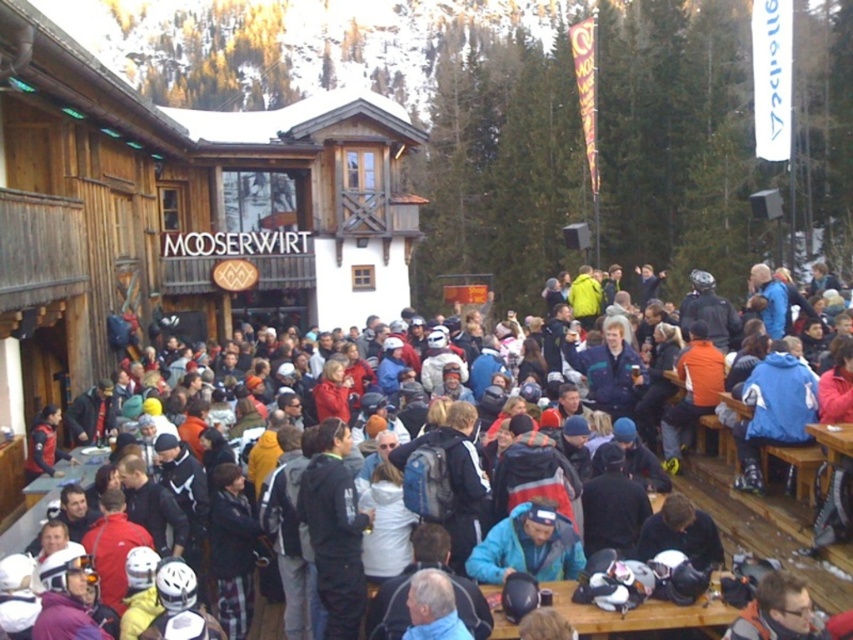
Who is shorter, wooden cabin at center or multicolored jackets at center?

Standing shorter between the two is multicolored jackets at center.

Identify the location of wooden cabin at center. (178, 212).